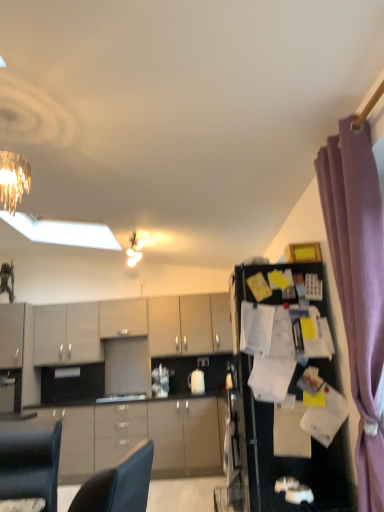
Question: Considering the relative sizes of matte gray cabinet at center, the 4th cabinetry when ordered from bottom to top, and glossy wood cabinets at center, the 4th cabinetry in the top-to-bottom sequence, in the image provided, is matte gray cabinet at center, the 4th cabinetry when ordered from bottom to top, shorter than glossy wood cabinets at center, the 4th cabinetry in the top-to-bottom sequence,?

Choices:
 (A) no
 (B) yes

Answer: (B)

Question: Is matte gray cabinet at center, the 4th cabinetry when ordered from bottom to top, aimed at glossy wood cabinets at center, which is the 1th cabinetry in bottom-to-top order?

Choices:
 (A) no
 (B) yes

Answer: (A)

Question: Is matte gray cabinet at center, placed as the first cabinetry when sorted from top to bottom, wider than glossy wood cabinets at center, which is the 1th cabinetry in bottom-to-top order?

Choices:
 (A) no
 (B) yes

Answer: (A)

Question: Is matte gray cabinet at center, placed as the first cabinetry when sorted from top to bottom, located outside glossy wood cabinets at center, which is the 1th cabinetry in bottom-to-top order?

Choices:
 (A) no
 (B) yes

Answer: (B)

Question: Is matte gray cabinet at center, the 4th cabinetry when ordered from bottom to top, taller than glossy wood cabinets at center, the 4th cabinetry in the top-to-bottom sequence?

Choices:
 (A) no
 (B) yes

Answer: (A)

Question: Looking at the image, does metallic chandelier at upper center seem bigger or smaller compared to matte gray cabinets at center, positioned as the 3th cabinetry in bottom-to-top order?

Choices:
 (A) big
 (B) small

Answer: (B)

Question: In the image, is metallic chandelier at upper center on the left side or the right side of matte gray cabinets at center, acting as the second cabinetry starting from the top?

Choices:
 (A) right
 (B) left

Answer: (B)

Question: From a real-world perspective, is metallic chandelier at upper center above or below matte gray cabinets at center, positioned as the 3th cabinetry in bottom-to-top order?

Choices:
 (A) below
 (B) above

Answer: (B)

Question: Does point tap(132, 237) appear closer or farther from the camera than point tap(221, 293)?

Choices:
 (A) farther
 (B) closer

Answer: (B)

Question: Does point click(342, 132) appear closer or farther from the camera than point click(84, 315)?

Choices:
 (A) closer
 (B) farther

Answer: (A)

Question: Is purple fabric curtain at right taller or shorter than matte gray cabinets at center, which is counted as the 3th cabinetry, starting from the top?

Choices:
 (A) tall
 (B) short

Answer: (A)

Question: From a real-world perspective, is purple fabric curtain at right physically located above or below matte gray cabinets at center, which is the 2th cabinetry from bottom to top?

Choices:
 (A) below
 (B) above

Answer: (A)

Question: Which is correct: purple fabric curtain at right is inside matte gray cabinets at center, which is counted as the 3th cabinetry, starting from the top, or outside of it?

Choices:
 (A) inside
 (B) outside

Answer: (B)

Question: From the image's perspective, relative to white paper at right, is glossy wood cabinets at center, the 4th cabinetry in the top-to-bottom sequence, above or below?

Choices:
 (A) below
 (B) above

Answer: (A)

Question: In the image, is glossy wood cabinets at center, which is the 1th cabinetry in bottom-to-top order, positioned in front of or behind white paper at right?

Choices:
 (A) front
 (B) behind

Answer: (B)